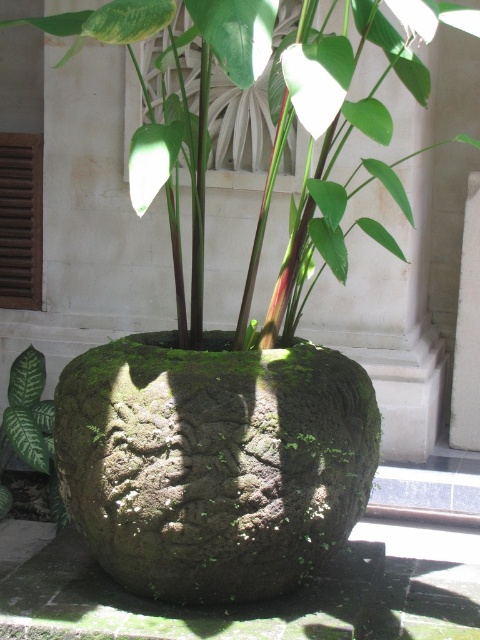
You are standing in front of the stone planter and want to place a small statue exactly halfway between point [386,179] and point [29,362]. Will the statue be closer to the front or the back of the planter?

The statue placed halfway between point [386,179] and point [29,362] will be closer to the front of the planter because point [386,179] is in front of point [29,362].

You are a gardener who needs to water the green mossy stone pot at center and the green matte leaf at lower left. You have a watering can with a 5 feet long handle. Can you water both plants without moving the watering can?

The distance between the green mossy stone pot at center and the green matte leaf at lower left is 7.30 feet. Since the watering can handle is only 5 feet long, you cannot reach both plants without moving the watering can.

You are standing in front of the stone planter and want to place a small statue exactly at the center of the green mossy stone pot at center. According to the coordinates provided, is the point at (175, 104) the correct location for the center?

The point at (175, 104) is the center of the green mossy stone pot at center, so yes, placing the statue there would be correct.